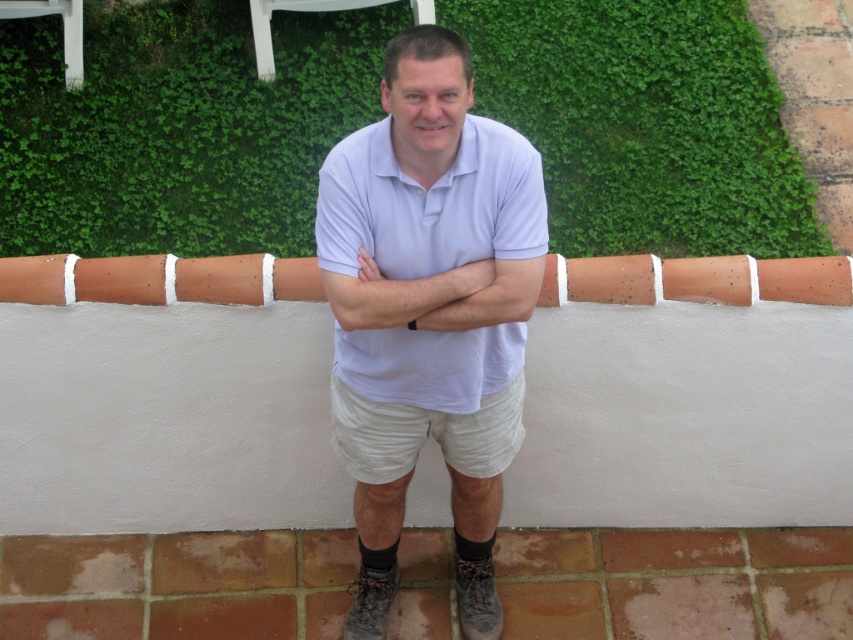
Is light blue cotton polo shirt at center further to the viewer compared to beige cotton shorts at center?

No, light blue cotton polo shirt at center is in front of beige cotton shorts at center.

Find the location of a particular element. The image size is (853, 640). light blue cotton polo shirt at center is located at coordinates (430, 204).

Is green leafy hedge at upper center below light blue cotton polo shirt at center?

No, green leafy hedge at upper center is not below light blue cotton polo shirt at center.

Does green leafy hedge at upper center have a smaller size compared to light blue cotton polo shirt at center?

Incorrect, green leafy hedge at upper center is not smaller in size than light blue cotton polo shirt at center.

Does point (340, 106) lie behind point (520, 324)?

Yes, it is behind point (520, 324).

At what (x,y) coordinates should I click in order to perform the action: click on green leafy hedge at upper center. Please return your answer as a coordinate pair (x, y). Image resolution: width=853 pixels, height=640 pixels. Looking at the image, I should click on (178, 125).

Who is more forward, (370, 282) or (390, 157)?

Point (390, 157) is more forward.

Can you confirm if light blue cotton shirt at center is wider than light blue cotton polo shirt at center?

Incorrect, light blue cotton shirt at center's width does not surpass light blue cotton polo shirt at center's.

The height and width of the screenshot is (640, 853). What are the coordinates of `light blue cotton shirt at center` in the screenshot? It's located at (428, 310).